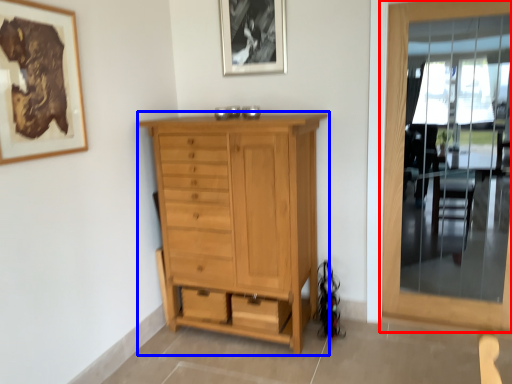
Question: Which point is further to the camera, door (highlighted by a red box) or chest of drawers (highlighted by a blue box)?

Choices:
 (A) door
 (B) chest of drawers

Answer: (A)